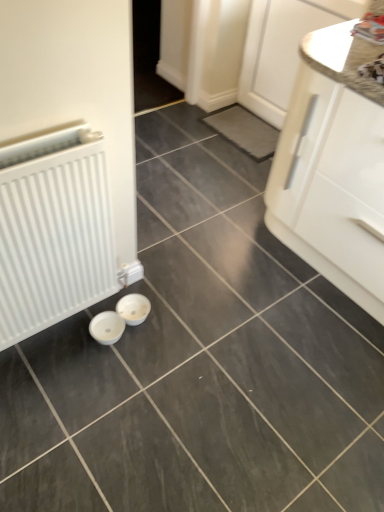
This screenshot has width=384, height=512. I want to click on free location to the left of white glossy cabinet at right, marked as the second cabinetry in a top-to-bottom arrangement, so click(201, 193).